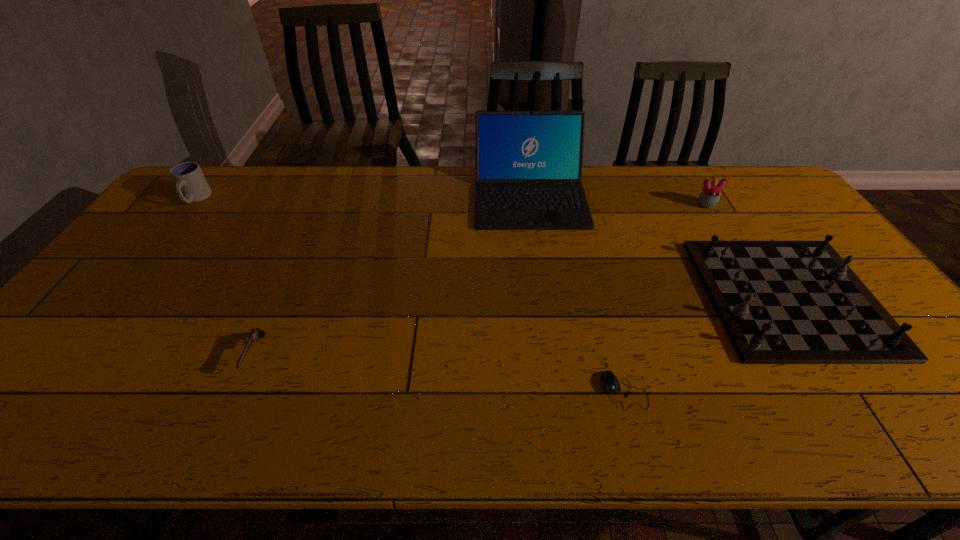
Image resolution: width=960 pixels, height=540 pixels. Identify the location of laptop computer. (529, 164).

I want to click on cup, so click(191, 184).

I want to click on cupcake, so click(709, 196).

Locate an element on the screen. The image size is (960, 540). the third shortest object is located at coordinates (781, 302).

Locate an element on the screen. The width and height of the screenshot is (960, 540). the fifth tallest object is located at coordinates (254, 336).

Find the location of a particular element. The width and height of the screenshot is (960, 540). pistol is located at coordinates (254, 336).

Where is `the shortest object`? This screenshot has width=960, height=540. the shortest object is located at coordinates pos(611,383).

At what (x,y) coordinates should I click in order to perform the action: click on vacant area located 0.100m on the screen of the laptop computer. Please return your answer as a coordinate pair (x, y). The height and width of the screenshot is (540, 960). Looking at the image, I should click on (538, 252).

Locate an element on the screen. This screenshot has width=960, height=540. free point located 0.370m with the handle on the side of the leftmost object is located at coordinates (123, 292).

I want to click on vacant space located on the face of the cupcake, so click(x=763, y=298).